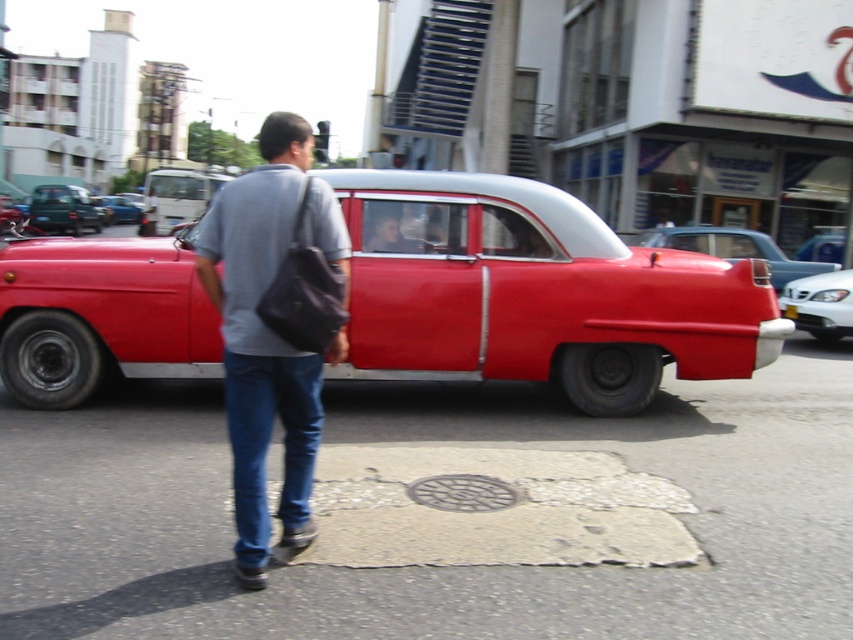
Is matte gray shirt at center closer to the viewer compared to white plastic license plate at center?

Yes.

Locate an element on the screen. matte gray shirt at center is located at coordinates (252, 490).

Locate an element on the screen. matte gray shirt at center is located at coordinates (252, 490).

Is point (822, 266) positioned after point (108, 200)?

No, (822, 266) is closer to viewer.

Who is more distant from viewer, (679, 243) or (113, 211)?

The point (113, 211) is behind.

Find the location of a particular element. The image size is (853, 640). shiny red car at right is located at coordinates (730, 248).

I want to click on shiny red car at center, so click(x=535, y=292).

Is point (637, 257) closer to camera compared to point (796, 310)?

Yes, point (637, 257) is in front of point (796, 310).

Where is `shiny red car at center`? The image size is (853, 640). shiny red car at center is located at coordinates coord(535,292).